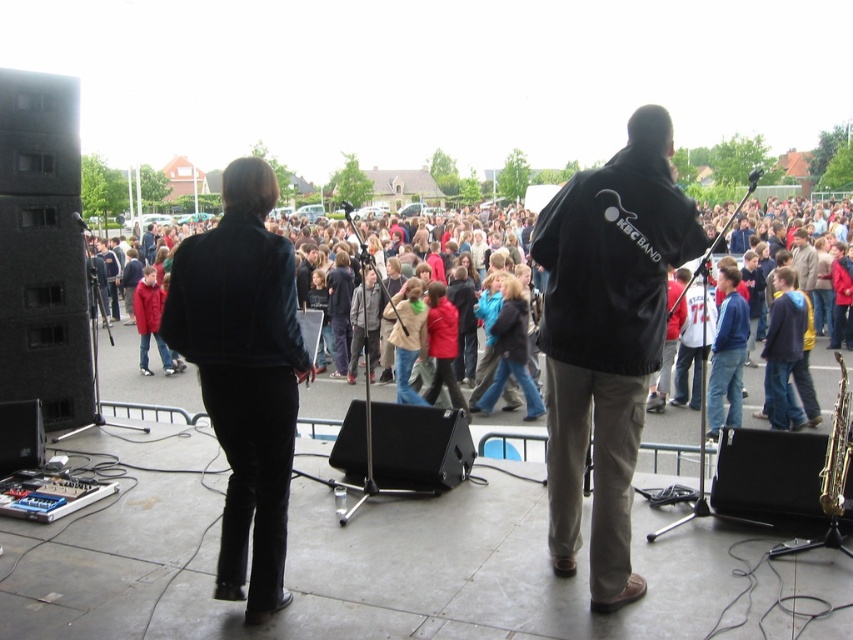
You are standing at the origin point of the coordinate system in the image. The black fabric jacket at center is located at coordinates 0.530, 0.712. If you want to move towards the jacket, in which direction should you move?

To move towards the black fabric jacket at center located at coordinates (606, 339) from the origin, you should move in the positive x and positive y direction.

You are a photographer at the event and want to take a photo of the gold metallic saxophone at lower right without the black fabric jacket at center blocking it. What should you do?

Move to the side so that the black fabric jacket at center is no longer in front of the gold metallic saxophone at lower right.